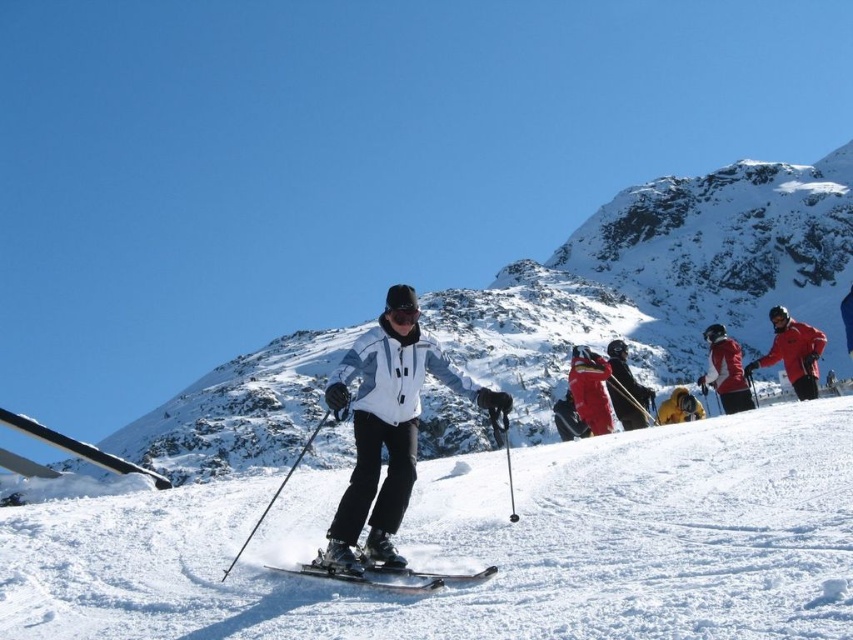
How distant is matte red ski suit at center from yellow fabric jacket at center?

matte red ski suit at center is 6.12 meters from yellow fabric jacket at center.

Does matte red ski suit at center have a larger size compared to yellow fabric jacket at center?

Indeed, matte red ski suit at center has a larger size compared to yellow fabric jacket at center.

This screenshot has width=853, height=640. I want to click on matte red ski suit at center, so click(584, 396).

Does red fabric jacket at center right appear over yellow fabric jacket at center?

Yes, red fabric jacket at center right is above yellow fabric jacket at center.

Describe the element at coordinates (724, 371) in the screenshot. The width and height of the screenshot is (853, 640). I see `red fabric jacket at center right` at that location.

Is point (712, 339) farther from camera compared to point (701, 417)?

Yes, point (712, 339) is farther from viewer.

You are a GUI agent. You are given a task and a screenshot of the screen. Output one action in this format:
    pyautogui.click(x=<x>, y=<y>)
    Task: Click on the red fabric jacket at center right
    
    Given the screenshot: What is the action you would take?
    pyautogui.click(x=724, y=371)

Does point (398, 561) lie in front of point (376, 570)?

No, (398, 561) is behind (376, 570).

Between point (372, 550) and point (471, 573), which one is positioned behind?

Point (372, 550)

Measure the distance between white matte jacket at center and camera.

31.95 meters

At what (x,y) coordinates should I click in order to perform the action: click on white matte jacket at center. Please return your answer as a coordinate pair (x, y). This screenshot has width=853, height=640. Looking at the image, I should click on (387, 426).